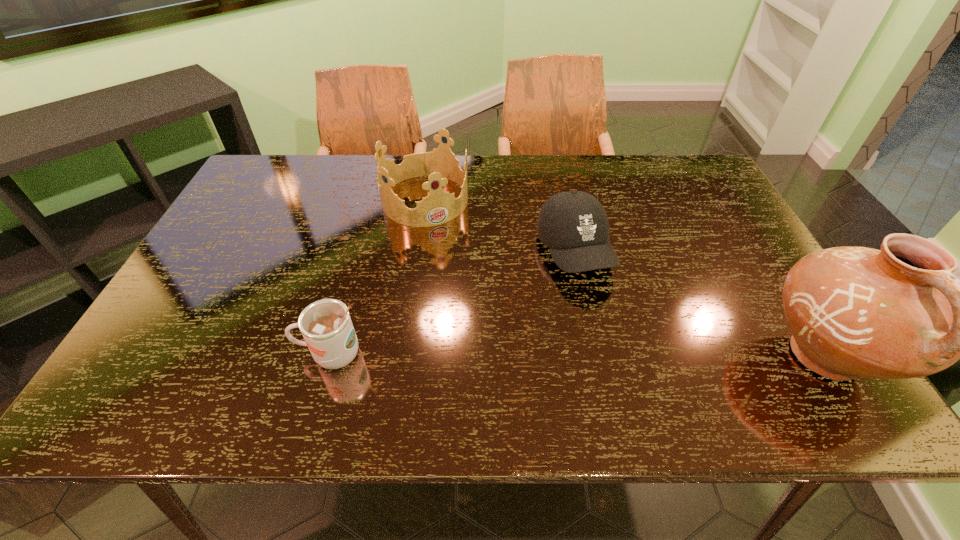
I want to click on vacant area that lies between the tiara and the baseball cap, so click(x=499, y=225).

The image size is (960, 540). I want to click on vacant point located between the pottery and the tiara, so click(625, 278).

Where is `vacant area that lies between the tiara and the rightmost object`? This screenshot has height=540, width=960. vacant area that lies between the tiara and the rightmost object is located at coordinates (625, 278).

This screenshot has width=960, height=540. Identify the location of empty space that is in between the pottery and the tiara. (625, 278).

Identify the location of unoccupied area between the cup and the baseball cap. The image size is (960, 540). (452, 302).

You are a GUI agent. You are given a task and a screenshot of the screen. Output one action in this format:
    pyautogui.click(x=<x>, y=<y>)
    Task: Click on the object that is the second closest to the rightmost object
    This screenshot has width=960, height=540.
    Given the screenshot: What is the action you would take?
    pyautogui.click(x=440, y=165)

Select which object is the second closest to the pottery. Please provide its 2D coordinates. Your answer should be formatted as a tuple, i.e. [(x, y)], where the tuple contains the x and y coordinates of a point satisfying the conditions above.

[(440, 165)]